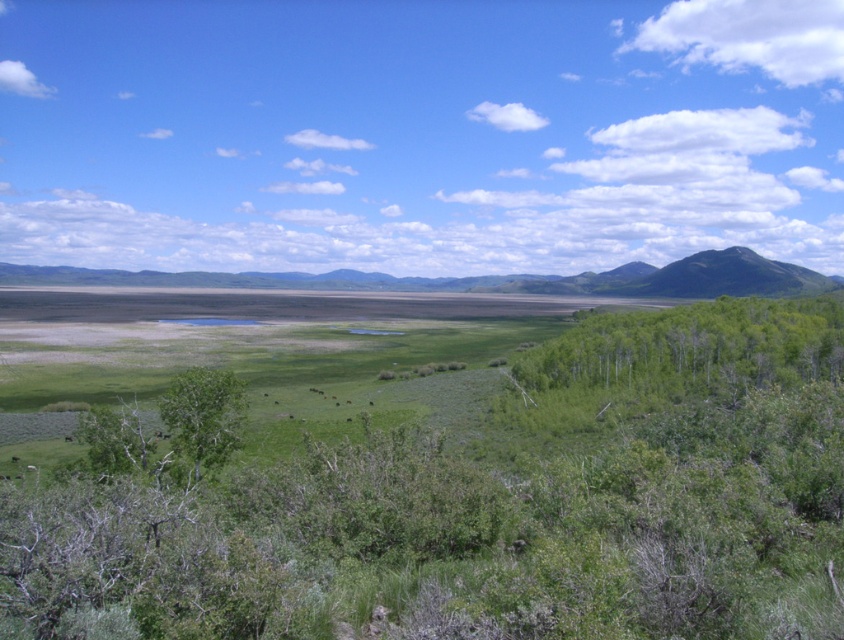
Question: Can you confirm if green leafy trees at right is positioned below green leafy tree at center?

Choices:
 (A) yes
 (B) no

Answer: (B)

Question: Among these points, which one is nearest to the camera?

Choices:
 (A) (193, 477)
 (B) (514, 362)

Answer: (A)

Question: Is green leafy trees at right to the left of green leafy tree at center from the viewer's perspective?

Choices:
 (A) yes
 (B) no

Answer: (B)

Question: Among these points, which one is farthest from the camera?

Choices:
 (A) (761, 348)
 (B) (218, 456)

Answer: (A)

Question: Does green leafy trees at right have a greater width compared to green leafy tree at center?

Choices:
 (A) no
 (B) yes

Answer: (B)